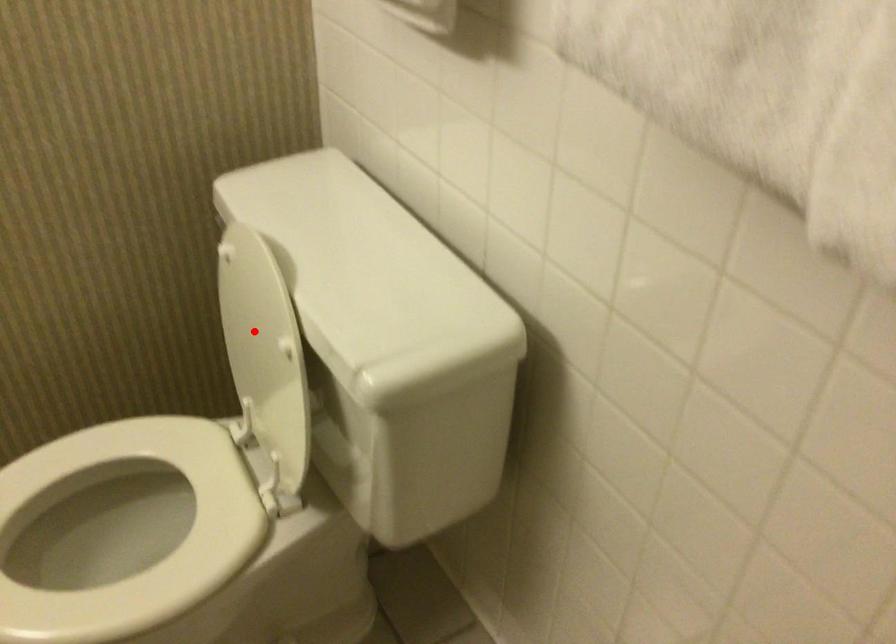
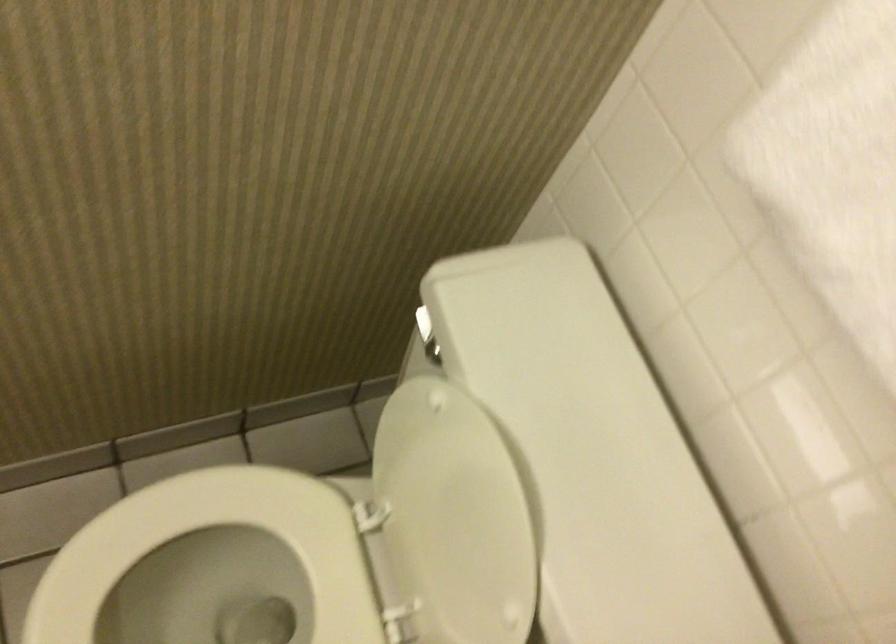
Locate, in the second image, the point that corresponds to the highlighted location in the first image.

(453, 518)